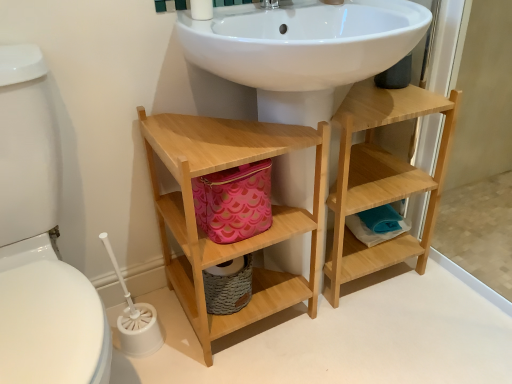
The height and width of the screenshot is (384, 512). What do you see at coordinates (39, 245) in the screenshot?
I see `white glossy toilet bowl at left` at bounding box center [39, 245].

Image resolution: width=512 pixels, height=384 pixels. What do you see at coordinates (135, 318) in the screenshot? I see `white plastic toilet brush at lower left` at bounding box center [135, 318].

Image resolution: width=512 pixels, height=384 pixels. In order to click on natural wood bathroom cabinet at lower center in this screenshot , I will do `click(240, 241)`.

Is white plastic toilet brush at lower left turned away from natural wood shelf at center?

That's not correct — white plastic toilet brush at lower left is not looking away from natural wood shelf at center.

Can you confirm if white plastic toilet brush at lower left is wider than natural wood shelf at center?

No, white plastic toilet brush at lower left is not wider than natural wood shelf at center.

What's the angular difference between white plastic toilet brush at lower left and natural wood shelf at center's facing directions?

There is a 0.604-degree angle between the facing directions of white plastic toilet brush at lower left and natural wood shelf at center.

Could natural wood shelf at center be considered to be inside white plastic toilet brush at lower left?

No, natural wood shelf at center is located outside of white plastic toilet brush at lower left.

Is point (180, 193) behind point (106, 246)?

That is False.

From the image's perspective, is natural wood bathroom cabinet at lower center on white plastic toilet brush at lower left?

Yes.

Locate an element on the screen. brush below the natural wood bathroom cabinet at lower center (from a real-world perspective) is located at coordinates (135, 318).

Looking at this image, from a real-world perspective, is natural wood bathroom cabinet at lower center located higher than white plastic toilet brush at lower left?

Yes, from a real-world perspective, natural wood bathroom cabinet at lower center is over white plastic toilet brush at lower left

Is natural wood bathroom cabinet at lower center facing towards white glossy toilet bowl at left?

No, natural wood bathroom cabinet at lower center does not turn towards white glossy toilet bowl at left.

Can you tell me how much natural wood bathroom cabinet at lower center and white glossy toilet bowl at left differ in facing direction?

The angular difference between natural wood bathroom cabinet at lower center and white glossy toilet bowl at left is 0.604 degrees.

Is natural wood bathroom cabinet at lower center shorter than white glossy toilet bowl at left?

Yes.

Considering the positions of points (336, 238) and (28, 73), is point (336, 238) closer to camera compared to point (28, 73)?

No, (336, 238) is further to viewer.

Which object is more forward, natural wood shelf at center or white glossy toilet bowl at left?

white glossy toilet bowl at left.

Who is taller, natural wood shelf at center or white glossy toilet bowl at left?

white glossy toilet bowl at left.

Looking at the image, does natural wood shelf at center seem bigger or smaller compared to white glossy toilet bowl at left?

In the image, natural wood shelf at center appears to be smaller than white glossy toilet bowl at left.

Is natural wood shelf at center inside the boundaries of white plastic toilet brush at lower left, or outside?

natural wood shelf at center is located beyond the bounds of white plastic toilet brush at lower left.

Looking at this image, is natural wood shelf at center wider or thinner than white plastic toilet brush at lower left?

natural wood shelf at center is wider than white plastic toilet brush at lower left.

Does point (365, 201) come closer to viewer compared to point (138, 337)?

No, it is behind (138, 337).

Is natural wood shelf at center looking in the opposite direction of white plastic toilet brush at lower left?

No.

Between point (46, 123) and point (218, 122), which one is positioned in front?

Positioned in front is point (46, 123).

In the scene shown: From the image's perspective, does white glossy toilet bowl at left appear lower than natural wood bathroom cabinet at lower center?

Indeed, from the image's perspective, white glossy toilet bowl at left is shown beneath natural wood bathroom cabinet at lower center.

Is white glossy toilet bowl at left to the right of natural wood bathroom cabinet at lower center from the viewer's perspective?

No.

Is white glossy toilet bowl at left oriented away from natural wood bathroom cabinet at lower center?

No.

Considering the sizes of natural wood bathroom cabinet at lower center and natural wood shelf at center in the image, is natural wood bathroom cabinet at lower center bigger or smaller than natural wood shelf at center?

natural wood bathroom cabinet at lower center is bigger than natural wood shelf at center.

From the image's perspective, is natural wood bathroom cabinet at lower center above natural wood shelf at center?

No, from the image's perspective, natural wood bathroom cabinet at lower center is not above natural wood shelf at center.

Can you tell me how much natural wood bathroom cabinet at lower center and natural wood shelf at center differ in facing direction?

There is a 4.49e-05-degree angle between the facing directions of natural wood bathroom cabinet at lower center and natural wood shelf at center.

In the image, there is a natural wood shelf at center. Identify the location of bathroom cabinet below it (from the image's perspective). (240, 241).

This screenshot has height=384, width=512. What are the coordinates of `brush behind the natural wood shelf at center` in the screenshot? It's located at (135, 318).

This screenshot has width=512, height=384. I want to click on brush below the natural wood bathroom cabinet at lower center (from the image's perspective), so click(x=135, y=318).

Based on their spatial positions, is natural wood bathroom cabinet at lower center or natural wood shelf at center further from white plastic toilet brush at lower left?

natural wood shelf at center is further to white plastic toilet brush at lower left.

Based on their spatial positions, is white plastic toilet brush at lower left or white glossy toilet bowl at left closer to natural wood bathroom cabinet at lower center?

Based on the image, white plastic toilet brush at lower left appears to be nearer to natural wood bathroom cabinet at lower center.

Looking at this image, when comparing their distances from natural wood bathroom cabinet at lower center, does white plastic toilet brush at lower left or natural wood shelf at center seem closer?

Based on the image, natural wood shelf at center appears to be nearer to natural wood bathroom cabinet at lower center.

Estimate the real-world distances between objects in this image. Which object is closer to natural wood shelf at center, natural wood bathroom cabinet at lower center or white glossy toilet bowl at left?

Among the two, natural wood bathroom cabinet at lower center is located nearer to natural wood shelf at center.

Estimate the real-world distances between objects in this image. Which object is further from white glossy toilet bowl at left, natural wood bathroom cabinet at lower center or natural wood shelf at center?

Among the two, natural wood shelf at center is located further to white glossy toilet bowl at left.

Estimate the real-world distances between objects in this image. Which object is further from natural wood shelf at center, natural wood bathroom cabinet at lower center or white plastic toilet brush at lower left?

Among the two, white plastic toilet brush at lower left is located further to natural wood shelf at center.

Based on their spatial positions, is white glossy toilet bowl at left or natural wood bathroom cabinet at lower center further from white plastic toilet brush at lower left?

white glossy toilet bowl at left is further to white plastic toilet brush at lower left.

Estimate the real-world distances between objects in this image. Which object is further from white glossy toilet bowl at left, natural wood bathroom cabinet at lower center or white plastic toilet brush at lower left?

white plastic toilet brush at lower left.

Identify the location of bathroom cabinet located between white plastic toilet brush at lower left and natural wood shelf at center in the left-right direction. The height and width of the screenshot is (384, 512). (240, 241).

Identify the location of brush between white glossy toilet bowl at left and natural wood shelf at center. Image resolution: width=512 pixels, height=384 pixels. (135, 318).

Where is `bathroom cabinet located between white glossy toilet bowl at left and white plastic toilet brush at lower left in the depth direction`? The width and height of the screenshot is (512, 384). bathroom cabinet located between white glossy toilet bowl at left and white plastic toilet brush at lower left in the depth direction is located at coordinates (240, 241).

The width and height of the screenshot is (512, 384). I want to click on bathroom cabinet located between white glossy toilet bowl at left and natural wood shelf at center in the left-right direction, so click(x=240, y=241).